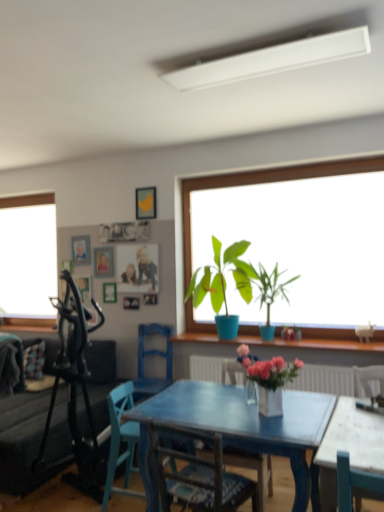
Question: From a real-world perspective, is green matte plant at center, which is the 2th houseplant from left to right, beneath wooden picture frame at upper center, positioned as the 2th picture frame in right-to-left order?

Choices:
 (A) yes
 (B) no

Answer: (B)

Question: Is green matte plant at center, placed as the 1th houseplant when sorted from right to left, taller than wooden picture frame at upper center, which ranks as the 1th picture frame in bottom-to-top order?

Choices:
 (A) yes
 (B) no

Answer: (A)

Question: Is green matte plant at center, placed as the 1th houseplant when sorted from right to left, located outside wooden picture frame at upper center, the 4th picture frame when ordered from top to bottom?

Choices:
 (A) yes
 (B) no

Answer: (A)

Question: From the image's perspective, would you say green matte plant at center, placed as the 1th houseplant when sorted from right to left, is shown under wooden picture frame at upper center, which ranks as the 1th picture frame in bottom-to-top order?

Choices:
 (A) no
 (B) yes

Answer: (A)

Question: Is wooden picture frame at upper center, which ranks as the 1th picture frame in bottom-to-top order, completely or partially inside green matte plant at center, which is the 2th houseplant from left to right?

Choices:
 (A) no
 (B) yes

Answer: (A)

Question: Considering the positions of point (288, 301) and point (349, 445), is point (288, 301) closer or farther from the camera than point (349, 445)?

Choices:
 (A) closer
 (B) farther

Answer: (B)

Question: Is green matte plant at center, placed as the 1th houseplant when sorted from right to left, inside or outside of white marble table at lower right?

Choices:
 (A) inside
 (B) outside

Answer: (B)

Question: Looking at the image, does green matte plant at center, placed as the 1th houseplant when sorted from right to left, seem bigger or smaller compared to white marble table at lower right?

Choices:
 (A) big
 (B) small

Answer: (A)

Question: In terms of width, does green matte plant at center, which is the 2th houseplant from left to right, look wider or thinner when compared to white marble table at lower right?

Choices:
 (A) thin
 (B) wide

Answer: (A)

Question: Considering the positions of white marble table at lower right and wooden chair at center, marked as the 3th chair in a back-to-front arrangement, in the image, is white marble table at lower right taller or shorter than wooden chair at center, marked as the 3th chair in a back-to-front arrangement,?

Choices:
 (A) tall
 (B) short

Answer: (B)

Question: Relative to wooden chair at center, placed as the 2th chair when sorted from front to back, is white marble table at lower right in front or behind?

Choices:
 (A) front
 (B) behind

Answer: (A)

Question: Considering the relative positions of white marble table at lower right and wooden chair at center, marked as the 3th chair in a back-to-front arrangement, in the image provided, is white marble table at lower right to the left or to the right of wooden chair at center, marked as the 3th chair in a back-to-front arrangement,?

Choices:
 (A) right
 (B) left

Answer: (A)

Question: Looking at their shapes, would you say white marble table at lower right is wider or thinner than wooden chair at center, marked as the 3th chair in a back-to-front arrangement?

Choices:
 (A) thin
 (B) wide

Answer: (B)

Question: From a real-world perspective, is blue wooden chair at center, which is the first chair from back to front, positioned above or below metallic gold picture frame at upper center, the 1th picture frame in the back-to-front sequence?

Choices:
 (A) below
 (B) above

Answer: (A)

Question: In terms of height, does blue wooden chair at center, which is the first chair from back to front, look taller or shorter compared to metallic gold picture frame at upper center, which is the 2th picture frame from top to bottom?

Choices:
 (A) tall
 (B) short

Answer: (A)